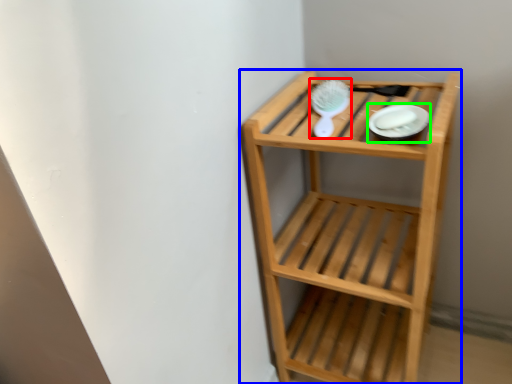
Question: Estimate the real-world distances between objects in this image. Which object is closer to brush (highlighted by a red box), shelf (highlighted by a blue box) or platter (highlighted by a green box)?

Choices:
 (A) shelf
 (B) platter

Answer: (B)